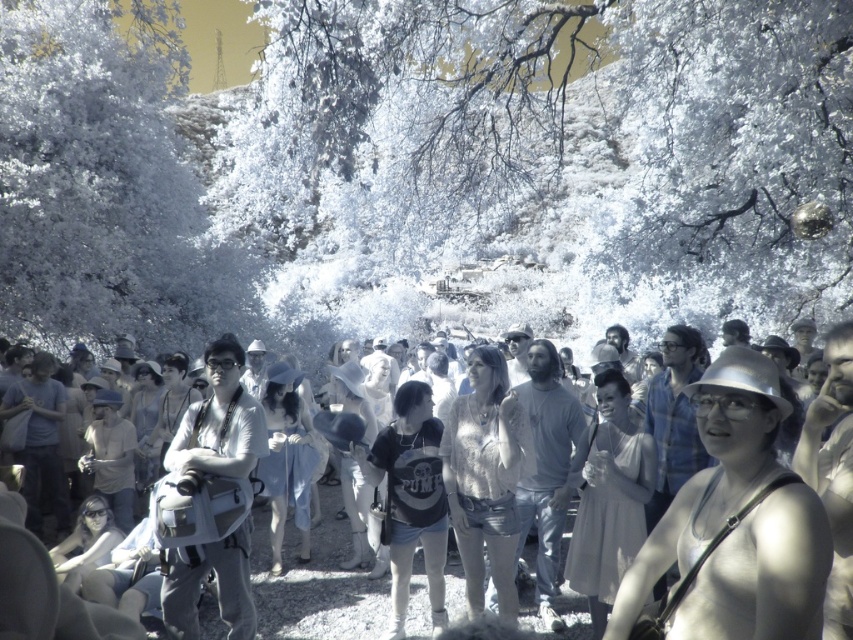
Question: Among these points, which one is farthest from the camera?

Choices:
 (A) tap(193, 403)
 (B) tap(782, 506)
 (C) tap(828, 556)
 (D) tap(433, 492)

Answer: (A)

Question: In this image, where is matte white shirt at center located relative to matte black t-shirt at center?

Choices:
 (A) right
 (B) left

Answer: (A)

Question: In this image, where is matte gray backpack at center located relative to matte black t-shirt at center?

Choices:
 (A) below
 (B) above

Answer: (A)

Question: Which is farther from the matte white shirt at center?

Choices:
 (A) white frosty tree at upper center
 (B) matte gray backpack at center
 (C) metallic silver hat at center
 (D) matte black t-shirt at center

Answer: (A)

Question: Among these points, which one is farthest from the camera?

Choices:
 (A) (252, 612)
 (B) (440, 545)

Answer: (B)

Question: Is white frosty tree at upper center wider than matte gray backpack at center?

Choices:
 (A) no
 (B) yes

Answer: (B)